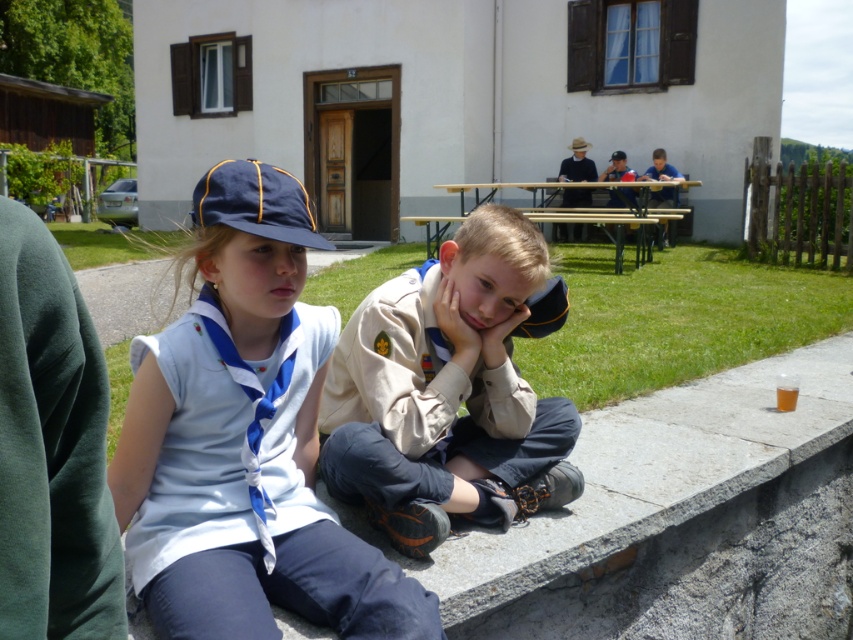
You are a photographer trying to capture the scene with the white cotton shirt at center and the wooden picnic table at center. Which object should you focus on first if you want to ensure both are in sharp focus?

The wooden picnic table at center should be focused on first because it is above the white cotton shirt at center, so adjusting focus starting from the higher object ensures both are in sharp focus.

You are standing at the edge of the campsite and want to place a small backpack between the tan fabric uniform at center and the wooden picnic table at center. Which object should you place the backpack closer to if you want it to be nearer to the viewer?

You should place the backpack closer to the tan fabric uniform at center because it is closer to the viewer than the wooden picnic table at center.